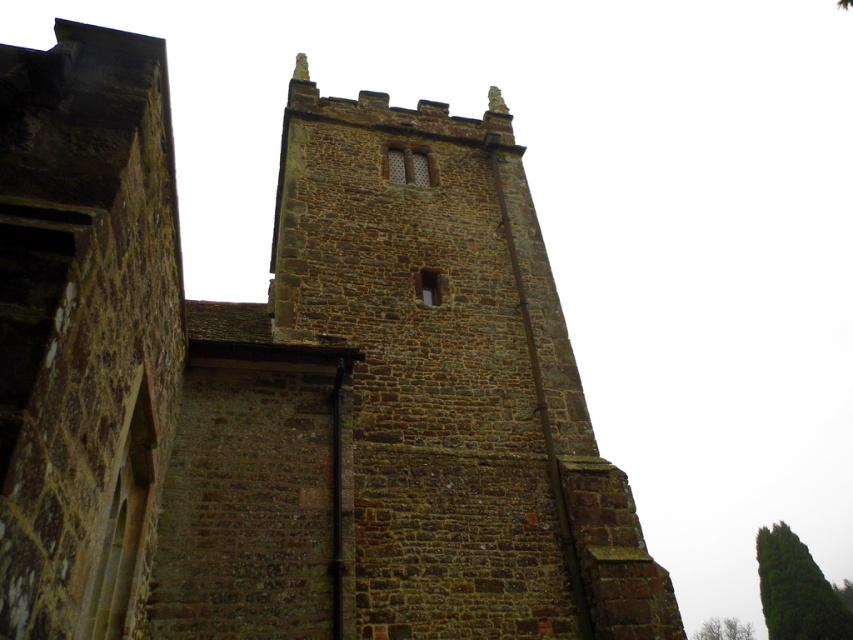
Question: Does green leafy tree at upper right appear over green leafy tree at lower right?

Choices:
 (A) no
 (B) yes

Answer: (B)

Question: Is green leafy tree at upper right to the right of green leafy tree at lower right from the viewer's perspective?

Choices:
 (A) yes
 (B) no

Answer: (B)

Question: Among these objects, which one is farthest from the camera?

Choices:
 (A) green leafy tree at upper right
 (B) green leafy tree at lower right

Answer: (B)

Question: Is the position of green leafy tree at upper right less distant than that of green leafy tree at lower right?

Choices:
 (A) yes
 (B) no

Answer: (A)